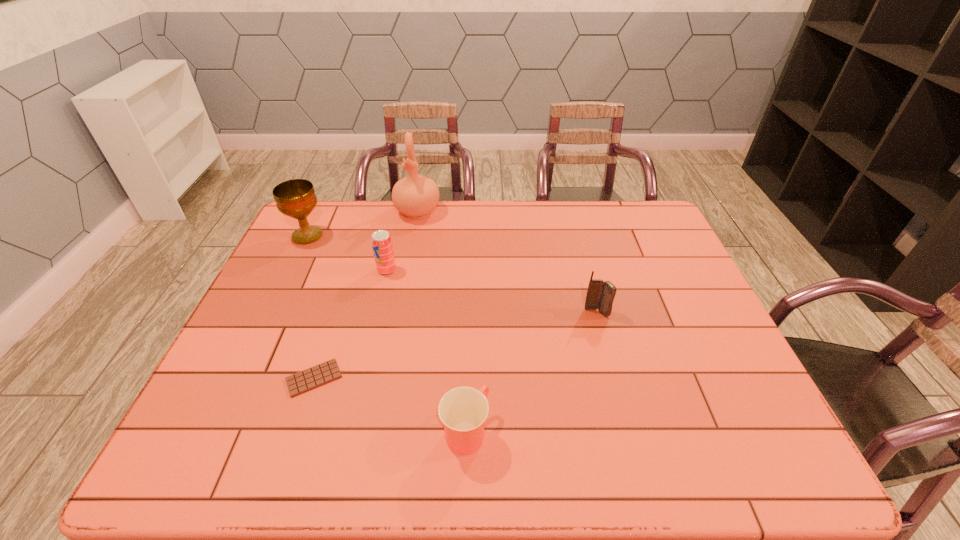
You are a GUI agent. You are given a task and a screenshot of the screen. Output one action in this format:
    pyautogui.click(x=<x>, y=<y>)
    Task: Click on the pottery
    
    Given the screenshot: What is the action you would take?
    pyautogui.click(x=416, y=196)

The image size is (960, 540). In order to click on the second tallest object in this screenshot , I will do `click(296, 198)`.

Identify the location of the leftmost object. Image resolution: width=960 pixels, height=540 pixels. (296, 198).

The height and width of the screenshot is (540, 960). I want to click on the fourth farthest object, so click(600, 295).

Locate an element on the screen. The width and height of the screenshot is (960, 540). the rightmost object is located at coordinates (600, 295).

You are a GUI agent. You are given a task and a screenshot of the screen. Output one action in this format:
    pyautogui.click(x=<x>, y=<y>)
    Task: Click on the fourth nearest object
    
    Given the screenshot: What is the action you would take?
    pyautogui.click(x=381, y=241)

Locate an element on the screen. This screenshot has width=960, height=540. cup is located at coordinates (463, 410).

Where is `the fifth object from left to right`? The width and height of the screenshot is (960, 540). the fifth object from left to right is located at coordinates (463, 410).

Identify the location of the shortest object. The height and width of the screenshot is (540, 960). (316, 376).

Where is `the fifth object from right to left`? the fifth object from right to left is located at coordinates (316, 376).